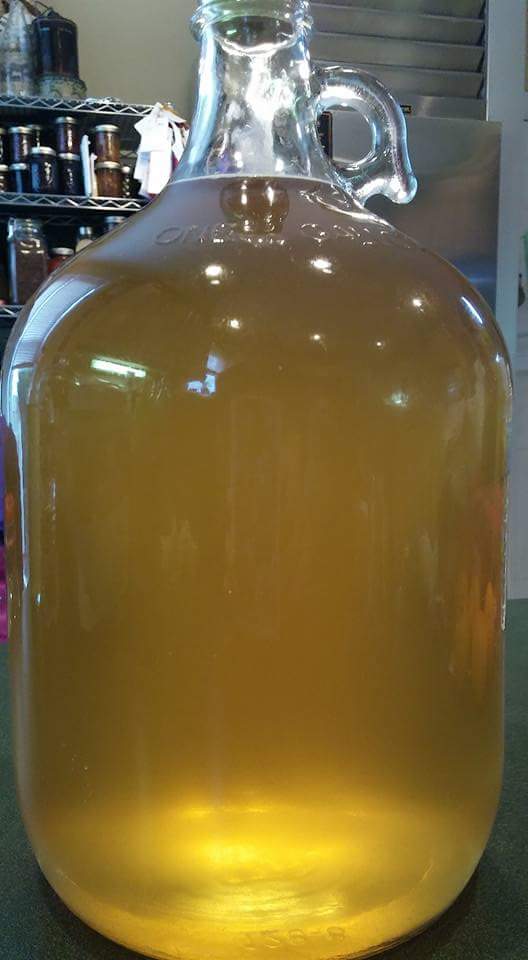
Where is `handle`? The width and height of the screenshot is (528, 960). handle is located at coordinates (x=390, y=148).